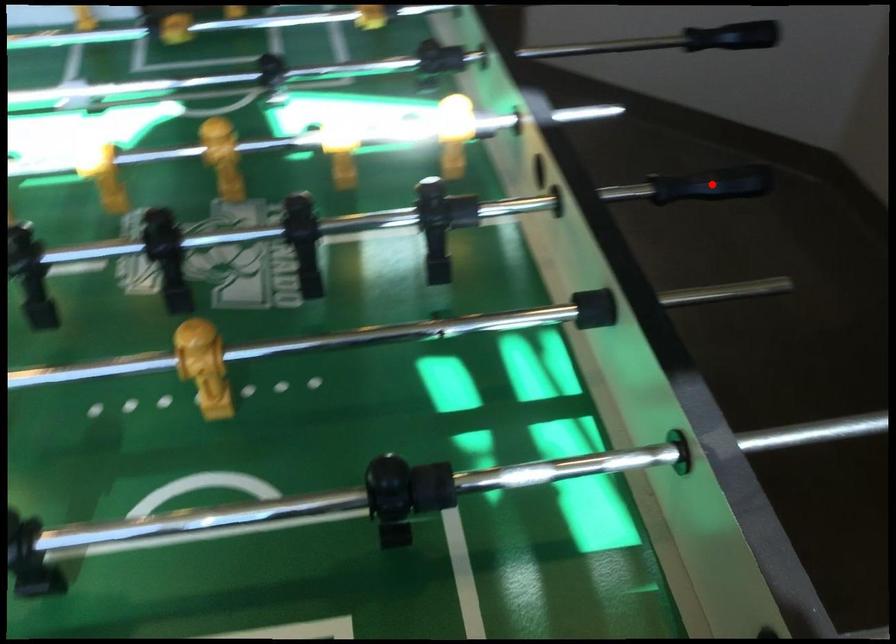
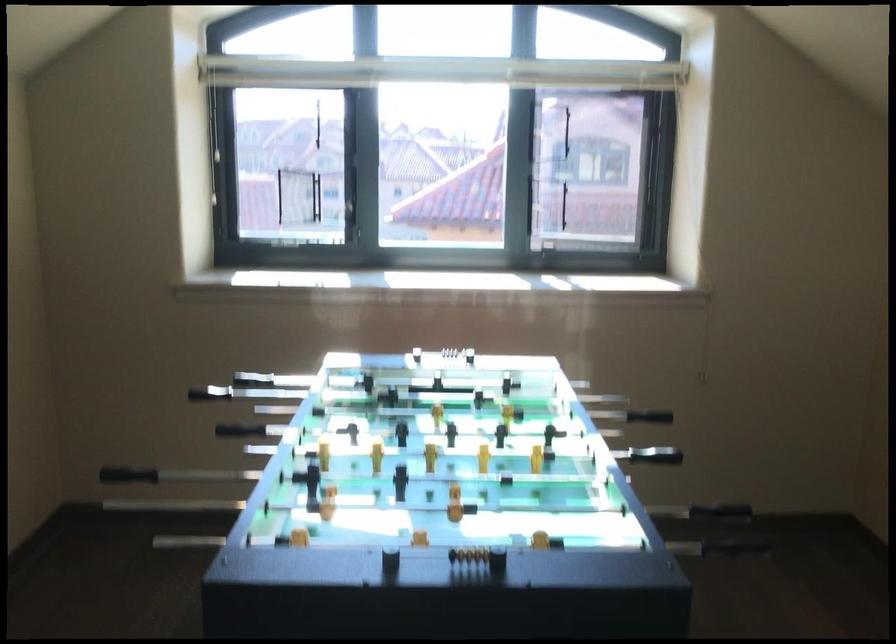
Question: I am providing you with two images of the same scene from different viewpoints. Given a red point in image1, look at the same physical point in image2. Is it:

Choices:
 (A) Closer to the viewpoint
 (B) Farther from the viewpoint

Answer: (B)